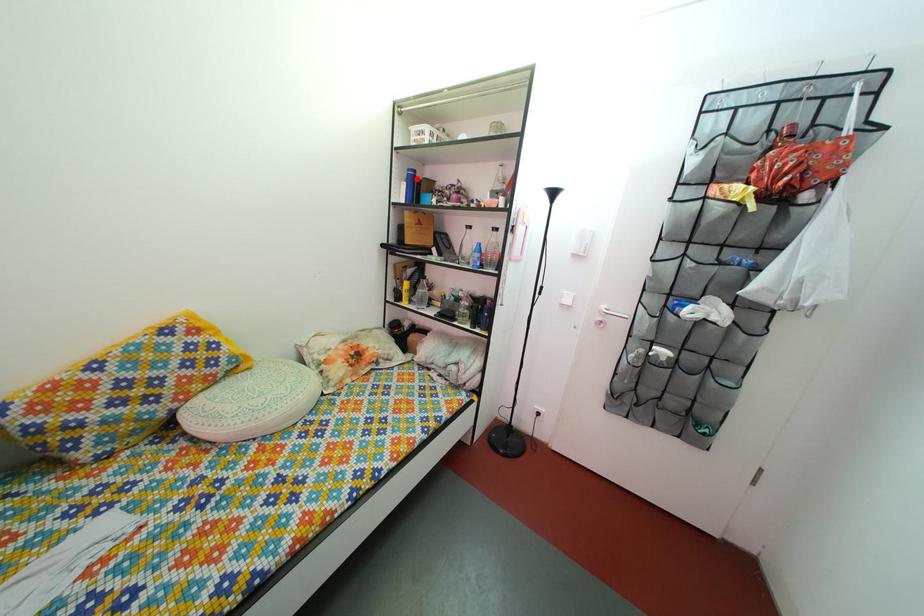
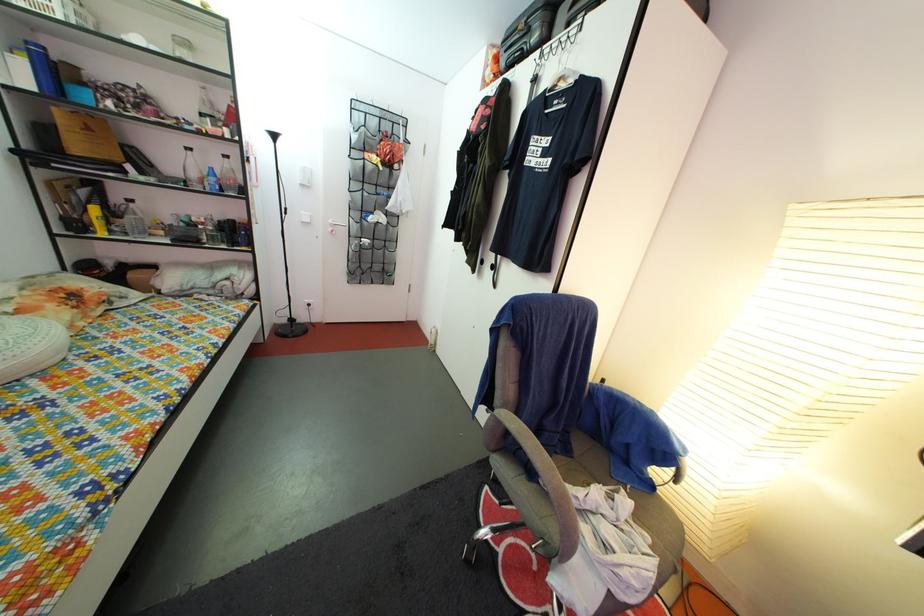
Locate, in the second image, the point that corresponds to the highlighted location in the first image.

(37, 51)